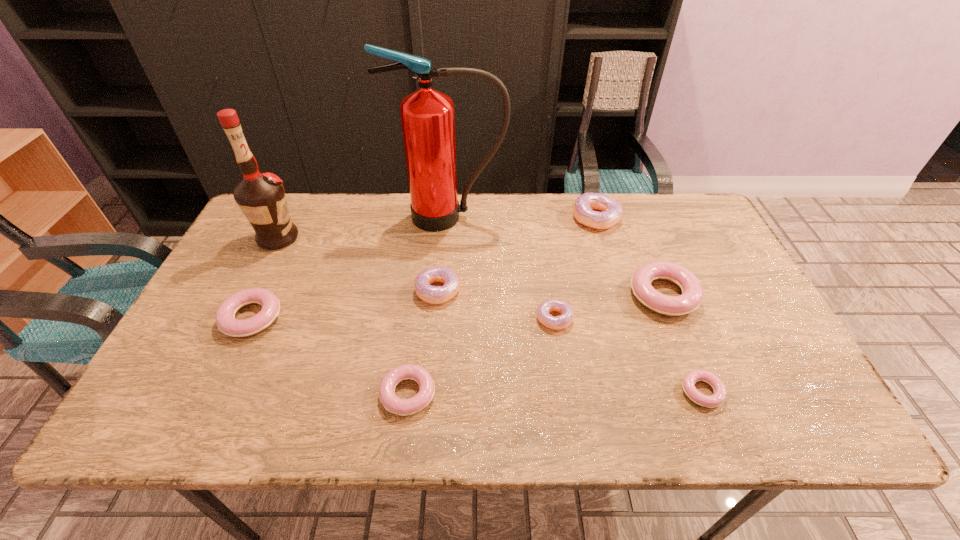
The height and width of the screenshot is (540, 960). I want to click on red fire extinguisher, so click(427, 116).

Where is `the tallest object`? the tallest object is located at coordinates (427, 116).

Where is `liquor`? liquor is located at coordinates (261, 197).

Where is `the biggest purple doughnut`? Image resolution: width=960 pixels, height=540 pixels. the biggest purple doughnut is located at coordinates (584, 205).

This screenshot has width=960, height=540. Identify the location of the rightmost purple doughnut. (584, 205).

Image resolution: width=960 pixels, height=540 pixels. What are the coordinates of `the biggest pink doughnut` in the screenshot? It's located at (692, 292).

I want to click on the leftmost purple doughnut, so click(430, 294).

Find the location of `the leftmost doughnut`. the leftmost doughnut is located at coordinates (225, 316).

Image resolution: width=960 pixels, height=540 pixels. Find the location of `the leftmost pink doughnut`. the leftmost pink doughnut is located at coordinates (225, 316).

Where is `the second purple doughnut from left to right`? the second purple doughnut from left to right is located at coordinates (560, 322).